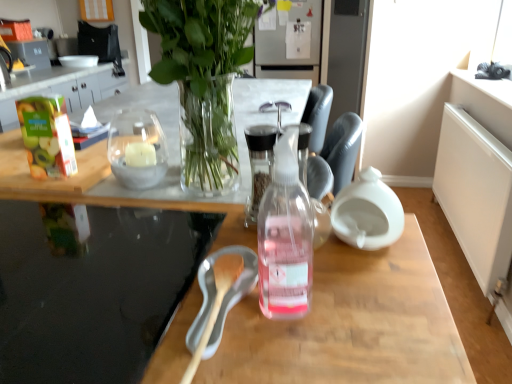
The width and height of the screenshot is (512, 384). Identify the location of free space behind clear glass bottle at center. (247, 244).